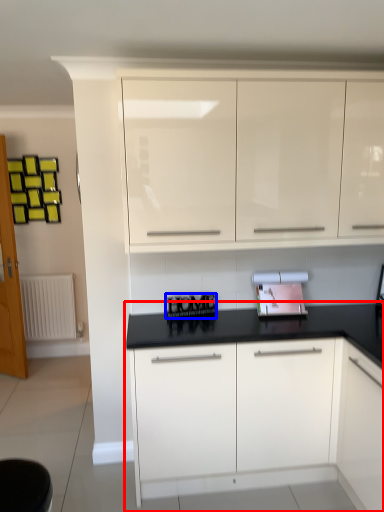
Question: Which point is further to the camera, cabinetry (highlighted by a red box) or writing (highlighted by a blue box)?

Choices:
 (A) cabinetry
 (B) writing

Answer: (B)